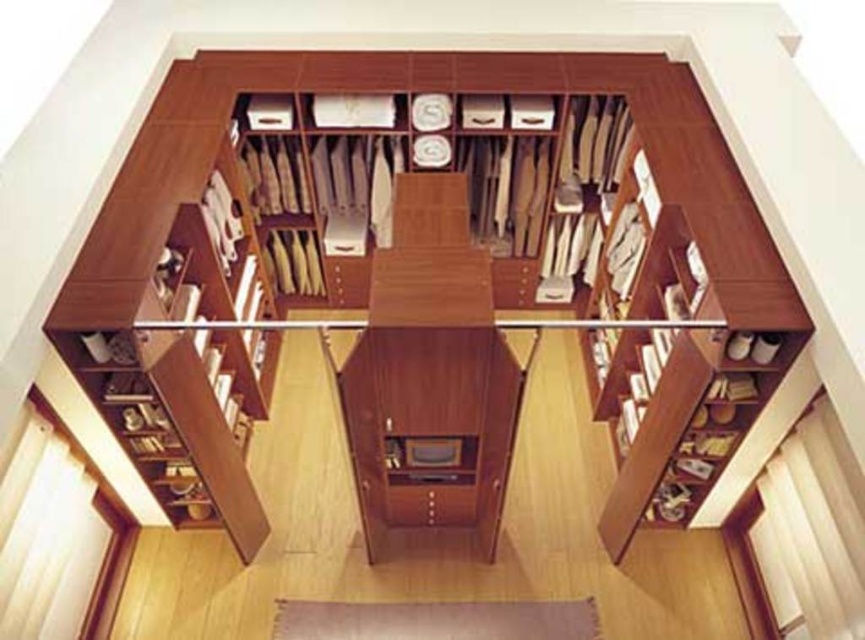
Who is positioned more to the left, wooden bookshelf at center or matte wood drawer at center?

matte wood drawer at center is more to the left.

The image size is (865, 640). In order to click on wooden bookshelf at center in this screenshot , I will do `click(425, 90)`.